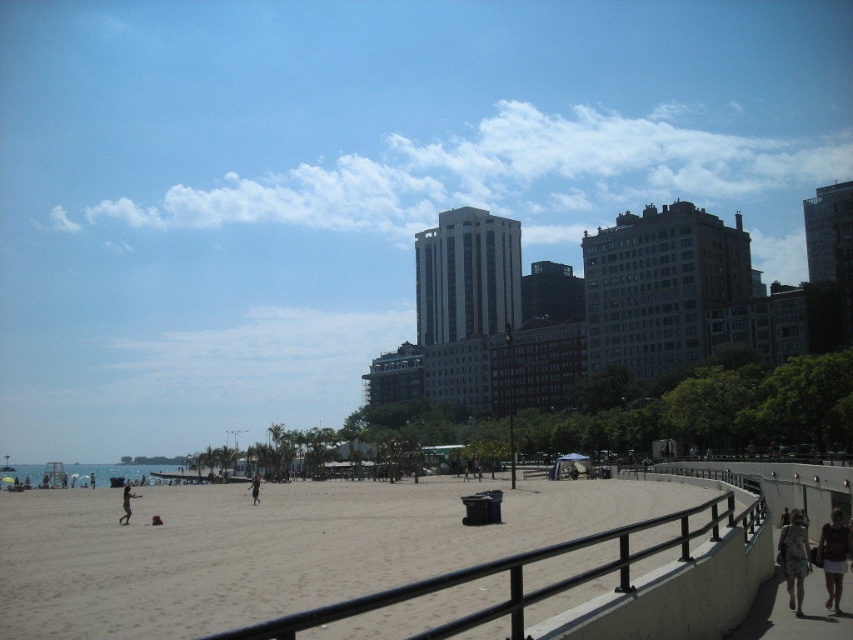
Which of these two, denim shorts at lower right or skinny jeans at center, stands taller?

skinny jeans at center is taller.

The width and height of the screenshot is (853, 640). What do you see at coordinates (793, 557) in the screenshot?
I see `denim shorts at lower right` at bounding box center [793, 557].

The image size is (853, 640). What are the coordinates of `denim shorts at lower right` in the screenshot? It's located at (793, 557).

Can you confirm if denim shorts at lower right is positioned above dark blue fabric person at center?

Yes.

Consider the image. Is denim shorts at lower right bigger than dark blue fabric person at center?

Actually, denim shorts at lower right might be smaller than dark blue fabric person at center.

Where is `denim shorts at lower right`? This screenshot has height=640, width=853. denim shorts at lower right is located at coordinates click(x=793, y=557).

Measure the distance from light brown sand at lower center to floral-patterned shirt at lower right.

light brown sand at lower center is 31.09 meters from floral-patterned shirt at lower right.

Does light brown sand at lower center appear on the left side of floral-patterned shirt at lower right?

Yes, light brown sand at lower center is to the left of floral-patterned shirt at lower right.

Who is more forward, (202, 596) or (833, 598)?

Positioned in front is point (833, 598).

I want to click on light brown sand at lower center, so click(x=268, y=548).